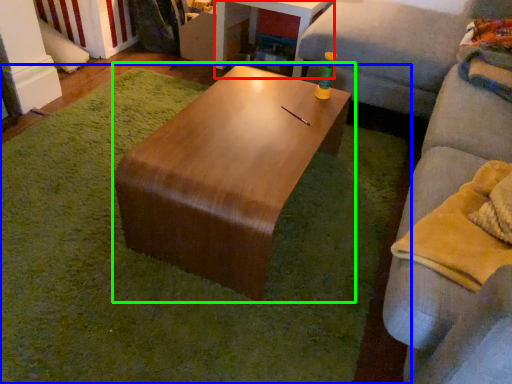
Question: Based on their relative distances, which object is farther from table (highlighted by a red box)? Choose from mat (highlighted by a blue box) and coffee table (highlighted by a green box).

Choices:
 (A) mat
 (B) coffee table

Answer: (A)